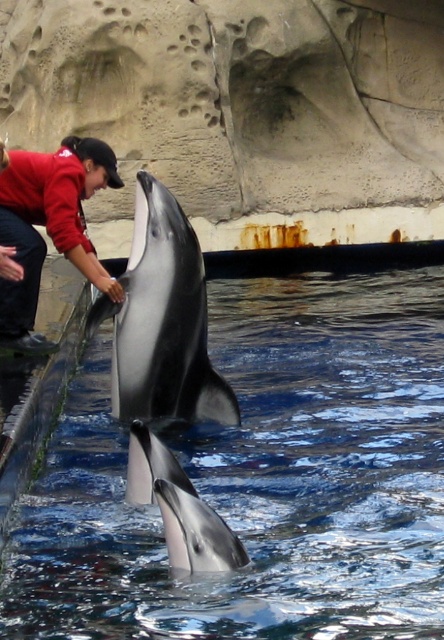
You are a photographer standing at the camera position. You want to take a photo of the dolphin and the person. Which point, point (201,410) or point (83,154), is closer to your camera lens?

Point (201,410) is closer to the camera than point (83,154), so the photographer should focus on that point first.

You are a marine biologist observing the dolphin and the person in the image. Which object is bigger, the black smooth dolphin at center or the red cotton shirt at left?

The black smooth dolphin at center is larger in size than the red cotton shirt at left.

You are a photographer positioned at the camera. You want to capture a photo of the dolphin and the person. Which of the two points, point (60, 221) or point (167, 531), is closer to your current position?

Point (60, 221) is further to the camera than point (167, 531). Therefore, point (167, 531) is closer to your current position.